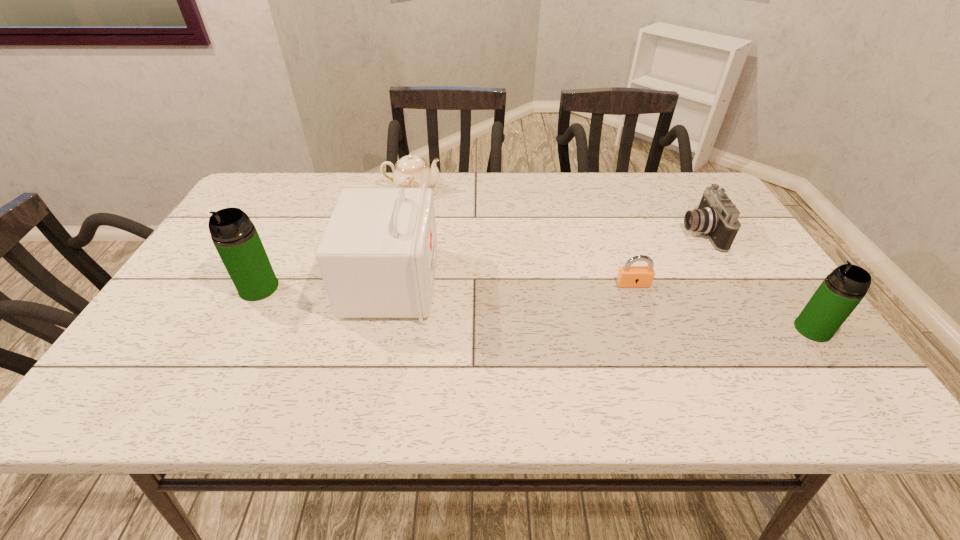
Locate an element on the screen. This screenshot has height=540, width=960. the left thermos bottle is located at coordinates (234, 236).

The image size is (960, 540). Find the location of `the leftmost object`. the leftmost object is located at coordinates (234, 236).

The image size is (960, 540). Identify the location of the rightmost object. (842, 290).

You are a GUI agent. You are given a task and a screenshot of the screen. Output one action in this format:
    pyautogui.click(x=<x>, y=<y>)
    Task: Click on the shorter thermos bottle
    
    Given the screenshot: What is the action you would take?
    pyautogui.click(x=842, y=290)

Locate an element on the screen. The height and width of the screenshot is (540, 960). chinaware is located at coordinates (411, 171).

You are a GUI agent. You are given a task and a screenshot of the screen. Output one action in this format:
    pyautogui.click(x=<x>, y=<y>)
    Task: Click on the first-aid kit
    
    Given the screenshot: What is the action you would take?
    pyautogui.click(x=377, y=257)

Where is `padlock`? The height and width of the screenshot is (540, 960). padlock is located at coordinates (628, 276).

The width and height of the screenshot is (960, 540). What are the coordinates of `the fourth object from left to right` in the screenshot? It's located at (628, 276).

At what (x,y) coordinates should I click in order to perform the action: click on camera. Please return your answer as a coordinate pair (x, y). Looking at the image, I should click on click(x=716, y=216).

Where is `vacant space located from the spout of the farther thermos bottle`? vacant space located from the spout of the farther thermos bottle is located at coordinates (231, 342).